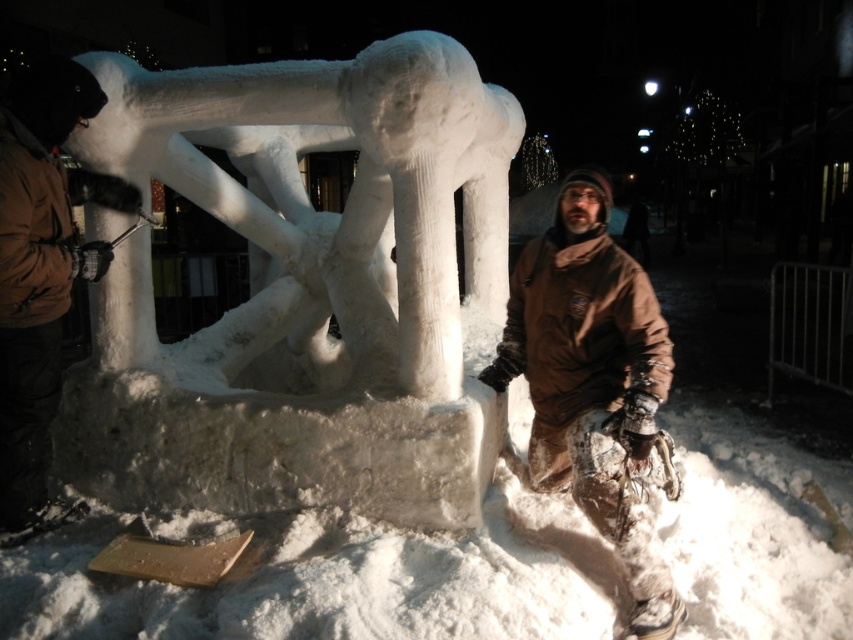
Question: Considering the real-world distances, which object is closest to the brown fuzzy jacket at lower right?

Choices:
 (A) brown woolen jacket at left
 (B) white snow sculpture at center

Answer: (B)

Question: Does white snow sculpture at center appear on the left side of brown fuzzy jacket at lower right?

Choices:
 (A) no
 (B) yes

Answer: (B)

Question: Observing the image, what is the correct spatial positioning of white snow sculpture at center in reference to brown fuzzy jacket at lower right?

Choices:
 (A) above
 (B) below

Answer: (A)

Question: Which point is closer to the camera?

Choices:
 (A) white snow sculpture at center
 (B) brown fuzzy jacket at lower right
 (C) brown woolen jacket at left

Answer: (B)

Question: Which point is closer to the camera taking this photo?

Choices:
 (A) 680,609
 (B) 346,435

Answer: (A)

Question: Is white snow sculpture at center wider than brown fuzzy jacket at lower right?

Choices:
 (A) no
 (B) yes

Answer: (B)